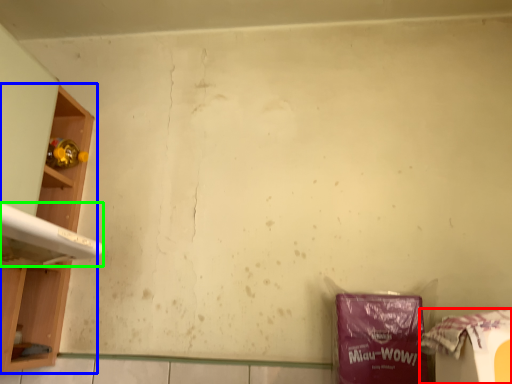
Question: Which is farther away from waste (highlighted by a red box)? shelf (highlighted by a blue box) or washing (highlighted by a green box)?

Choices:
 (A) shelf
 (B) washing

Answer: (A)